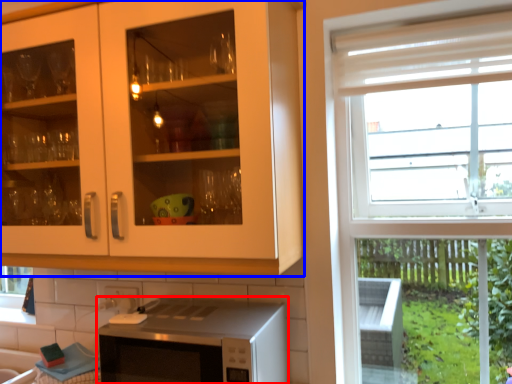
Question: Which point is closer to the camera, microwave oven (highlighted by a red box) or cabinetry (highlighted by a blue box)?

Choices:
 (A) microwave oven
 (B) cabinetry

Answer: (B)